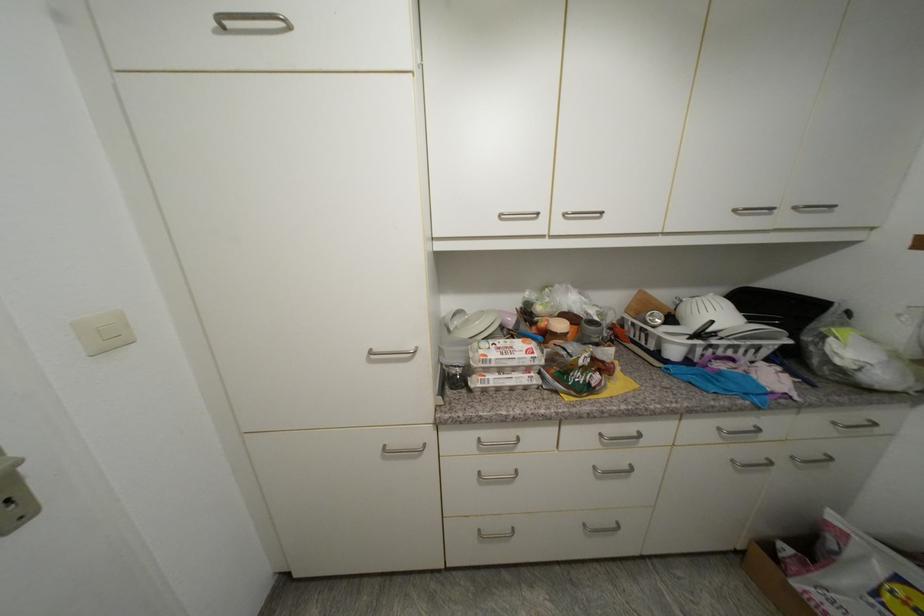
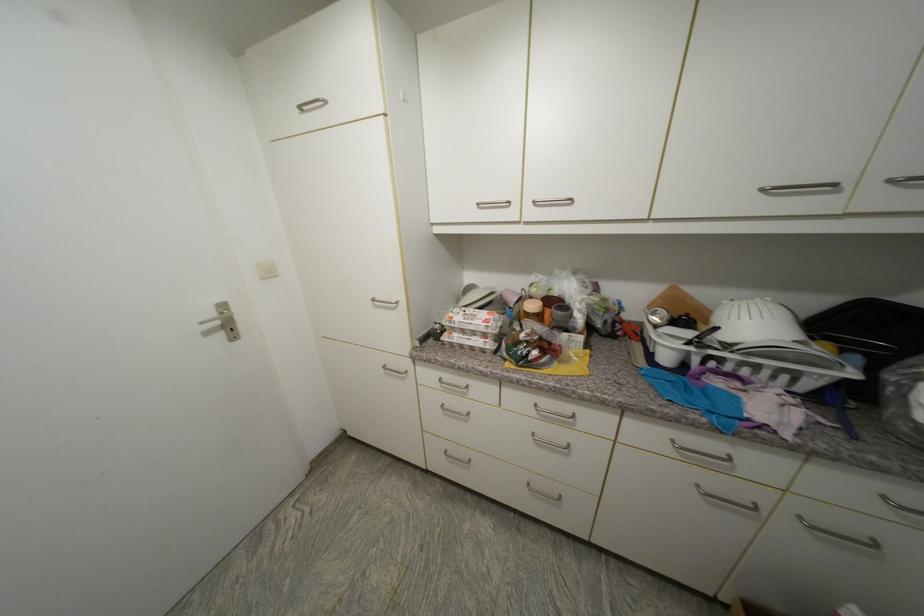
Question: The images are taken continuously from a first-person perspective. In which direction are you moving?

Choices:
 (A) Left
 (B) Right
 (C) Forward
 (D) Backward

Answer: (B)